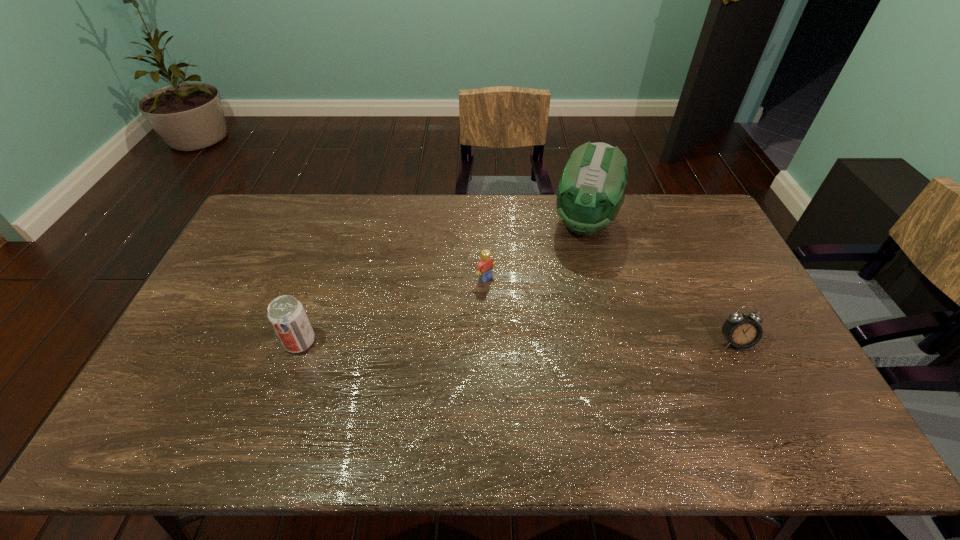
I want to click on free space at the far left corner of the desktop, so pyautogui.click(x=272, y=211).

Where is `free space at the far right corner of the desktop`? The image size is (960, 540). free space at the far right corner of the desktop is located at coordinates (692, 211).

In the image, there is a desktop. In order to click on vacant space at the near right corner in this screenshot , I will do `click(756, 394)`.

The image size is (960, 540). I want to click on empty space that is in between the second farthest object and the leftmost object, so click(393, 310).

Locate an element on the screen. Image resolution: width=960 pixels, height=540 pixels. vacant space that's between the tallest object and the soda can is located at coordinates (442, 282).

Locate an element on the screen. This screenshot has width=960, height=540. vacant space that is in between the third nearest object and the soda can is located at coordinates (393, 310).

Find the location of a particular element. free point between the rightmost object and the second farthest object is located at coordinates (611, 310).

Locate an element on the screen. unoccupied area between the football helmet and the soda can is located at coordinates (442, 282).

Image resolution: width=960 pixels, height=540 pixels. Find the location of `free space between the Lego and the alarm clock`. free space between the Lego and the alarm clock is located at coordinates (611, 310).

The image size is (960, 540). Identify the location of free space between the third nearest object and the leftmost object. (393, 310).